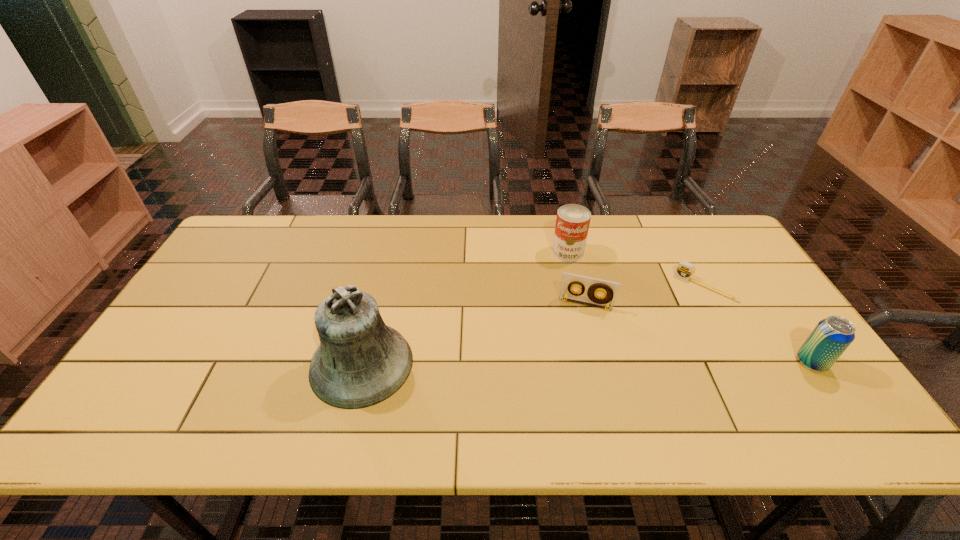
The height and width of the screenshot is (540, 960). Find the location of `free space on the desktop that is between the bell and the beer can and is positioned on the front label of the can`. free space on the desktop that is between the bell and the beer can and is positioned on the front label of the can is located at coordinates (529, 363).

The width and height of the screenshot is (960, 540). Identify the location of vacant spot on the desktop that is between the bell and the beer can and is positioned at the front of the second shortest object with visible reels. (574, 363).

You are a GUI agent. You are given a task and a screenshot of the screen. Output one action in this format:
    pyautogui.click(x=<x>, y=<y>)
    Task: Click on the free space on the desktop that is between the tallest object and the beer can and is positioned at the front of the tape measure with the tape extended
    
    Given the screenshot: What is the action you would take?
    pyautogui.click(x=653, y=363)